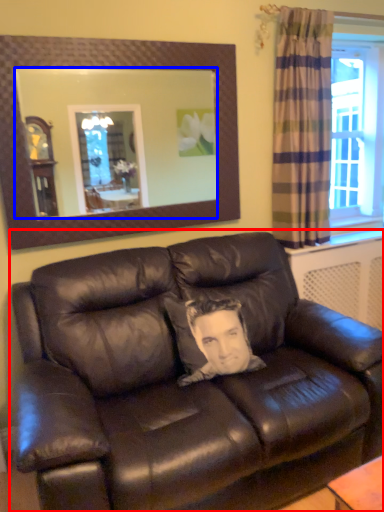
Question: Which point is further to the camera, studio couch (highlighted by a red box) or mirror (highlighted by a blue box)?

Choices:
 (A) studio couch
 (B) mirror

Answer: (B)